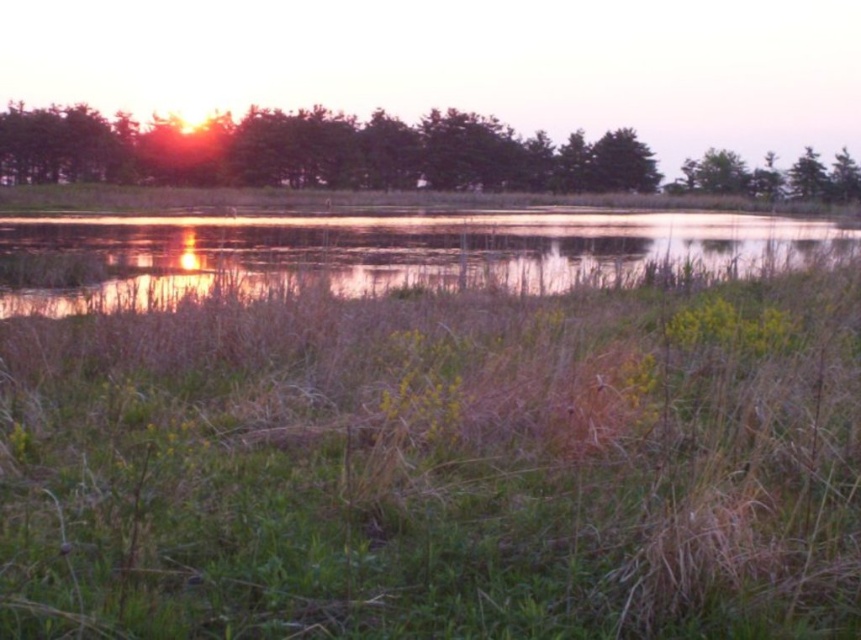
You are standing at the edge of the wetland and want to walk to the reflective water at center. Which direction should you head towards from the green grassy at center?

The green grassy at center is to the right of reflective water at center, so you should head to the left to reach the reflective water at center.

You are an environmental scientist analyzing the image. You need to determine which object occupies a wider area in the scene between the reflective water at center and the green leafy trees at upper center. Which one is wider?

The reflective water at center is less than the green leafy trees at upper center in width, so the green leafy trees at upper center are wider.